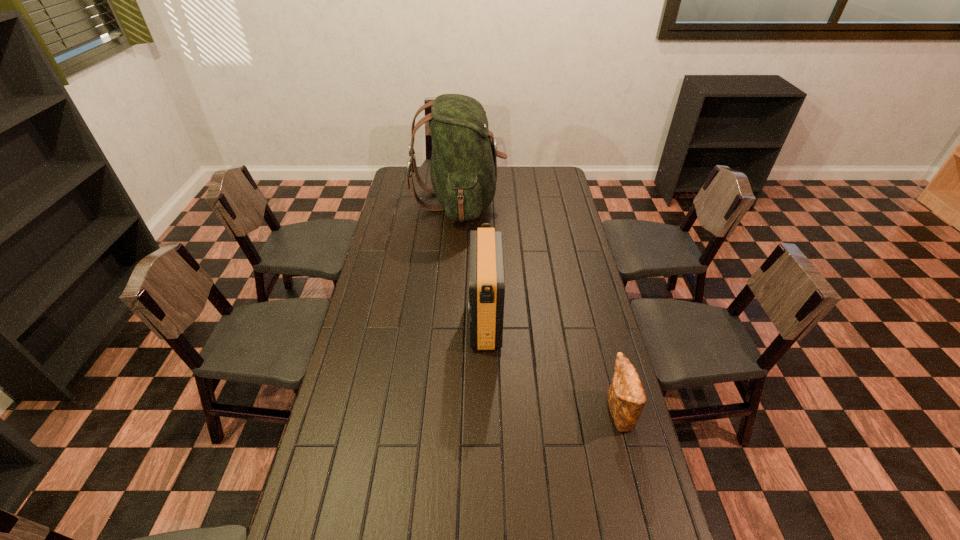
The height and width of the screenshot is (540, 960). Identify the location of vacant space located 0.320m on the open side of the nearest object. pyautogui.click(x=498, y=414).

Image resolution: width=960 pixels, height=540 pixels. What are the coordinates of `vacant point located 0.400m on the open side of the nearest object` in the screenshot? It's located at (472, 414).

This screenshot has width=960, height=540. Find the location of `free location located on the open side of the nearest object`. free location located on the open side of the nearest object is located at coordinates (525, 414).

Identify the location of object located at the far edge. (463, 170).

Where is `object present at the left edge`? object present at the left edge is located at coordinates (463, 170).

Where is `object present at the right edge`? This screenshot has height=540, width=960. object present at the right edge is located at coordinates (626, 399).

Find the location of a particular element. object present at the far left corner is located at coordinates (463, 170).

Where is `free region at the far edge of the desktop`? This screenshot has height=540, width=960. free region at the far edge of the desktop is located at coordinates (527, 166).

At what (x,y) coordinates should I click in order to perform the action: click on vacant space at the left edge of the desktop. Please return your answer as a coordinate pair (x, y). The width and height of the screenshot is (960, 540). Looking at the image, I should click on (336, 465).

Where is `free space at the right edge`? free space at the right edge is located at coordinates (591, 315).